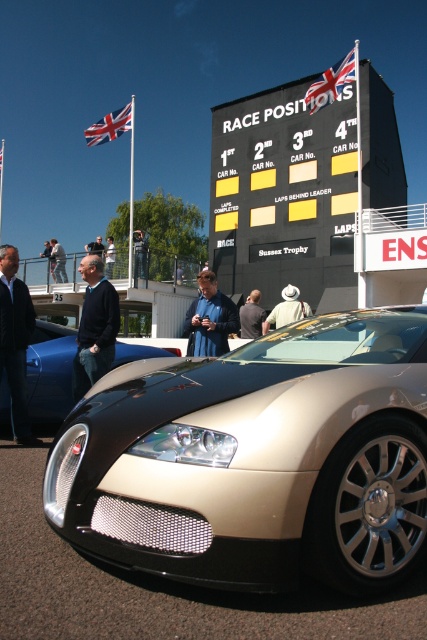
Question: Which of the following is the farthest from the observer?

Choices:
 (A) (99, 323)
 (B) (228, 310)

Answer: (B)

Question: Which point is closer to the camera?

Choices:
 (A) black/yellow scoreboard at center
 (B) dark blue sweater at center
 (C) dark blue suit at left

Answer: (C)

Question: Does shiny blue car at center have a lesser width compared to dark blue suit at left?

Choices:
 (A) yes
 (B) no

Answer: (A)

Question: Does shiny blue car at center appear over dark blue sweater at center?

Choices:
 (A) no
 (B) yes

Answer: (A)

Question: Which is farther from the dark blue jacket at center?

Choices:
 (A) black/yellow scoreboard at center
 (B) dark blue suit at left
 (C) shiny beige car at center

Answer: (A)

Question: Is dark blue sweater at center smaller than dark blue jacket at center?

Choices:
 (A) no
 (B) yes

Answer: (A)